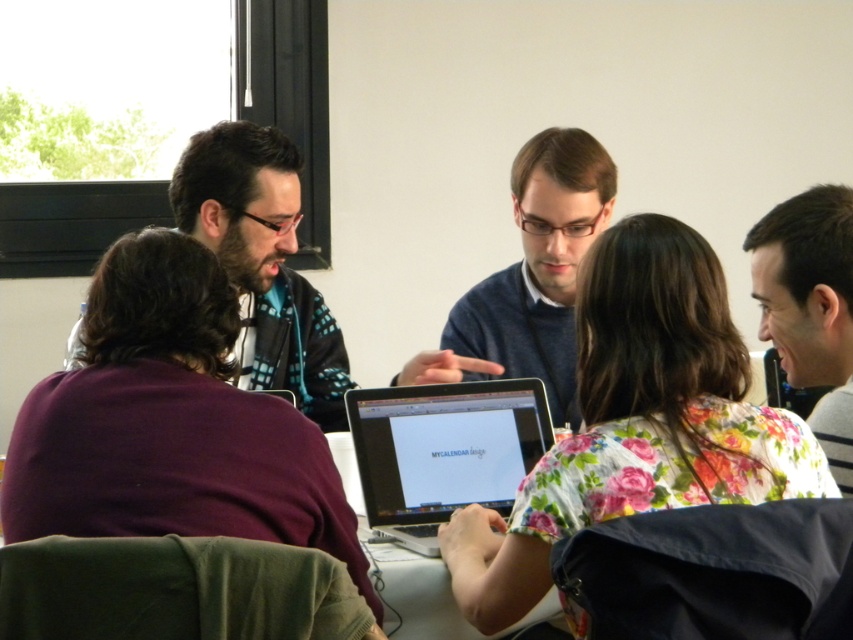
Question: Among these objects, which one is farthest from the camera?

Choices:
 (A) blue sweater at center
 (B) white glossy table at center
 (C) silver metallic laptop at center

Answer: (A)

Question: Where is dark blue sweater at upper left located in relation to blue sweater at center in the image?

Choices:
 (A) above
 (B) below

Answer: (A)

Question: Which point is closer to the camera?

Choices:
 (A) blue sweater at center
 (B) dark blue sweater at upper left

Answer: (B)

Question: Can you confirm if dark brown hair at upper right is bigger than white glossy table at center?

Choices:
 (A) no
 (B) yes

Answer: (A)

Question: Which of the following is the closest to the observer?

Choices:
 (A) dark blue sweater at upper left
 (B) white glossy table at center

Answer: (B)

Question: Can you confirm if silver metallic laptop at center is bigger than dark brown hair at upper right?

Choices:
 (A) no
 (B) yes

Answer: (A)